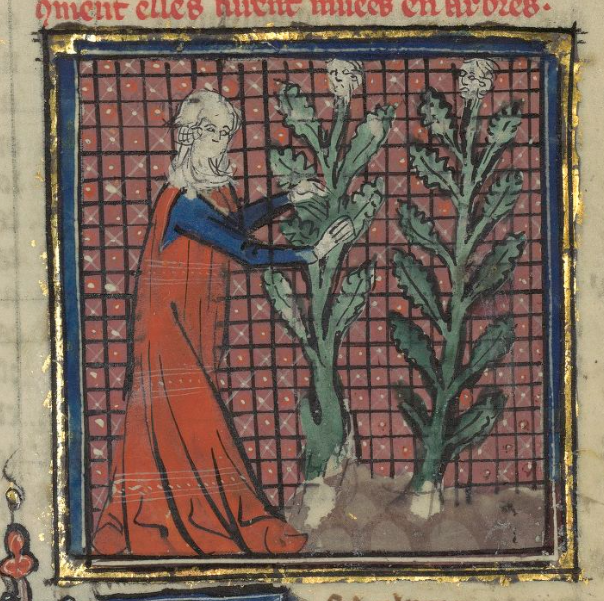
Where is `plant`? The width and height of the screenshot is (604, 601). plant is located at coordinates (448, 376), (312, 373).